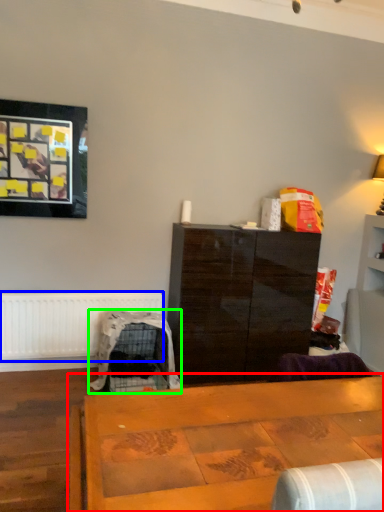
Question: Which is nearer to the table (highlighted by a red box)? radiator (highlighted by a blue box) or swivel chair (highlighted by a green box).

Choices:
 (A) radiator
 (B) swivel chair

Answer: (B)